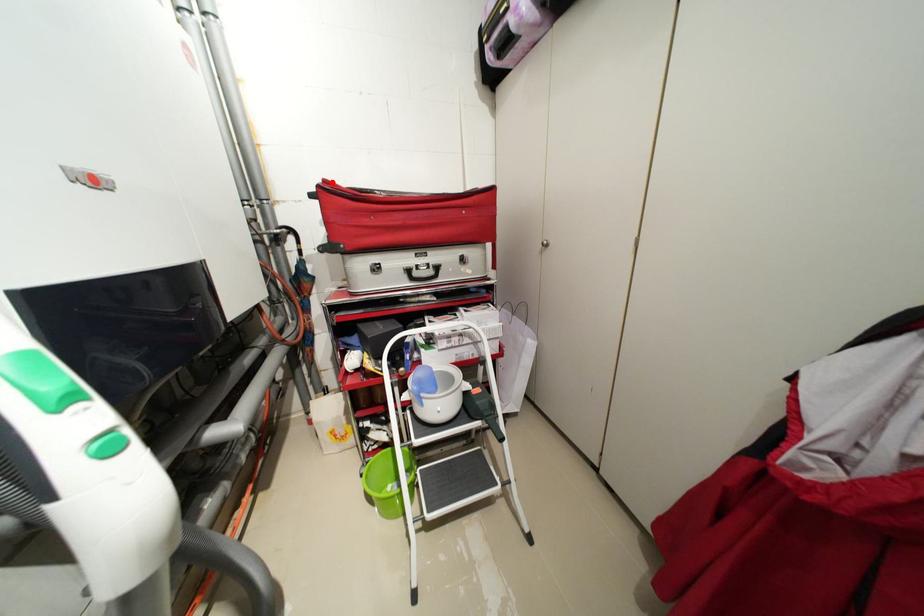
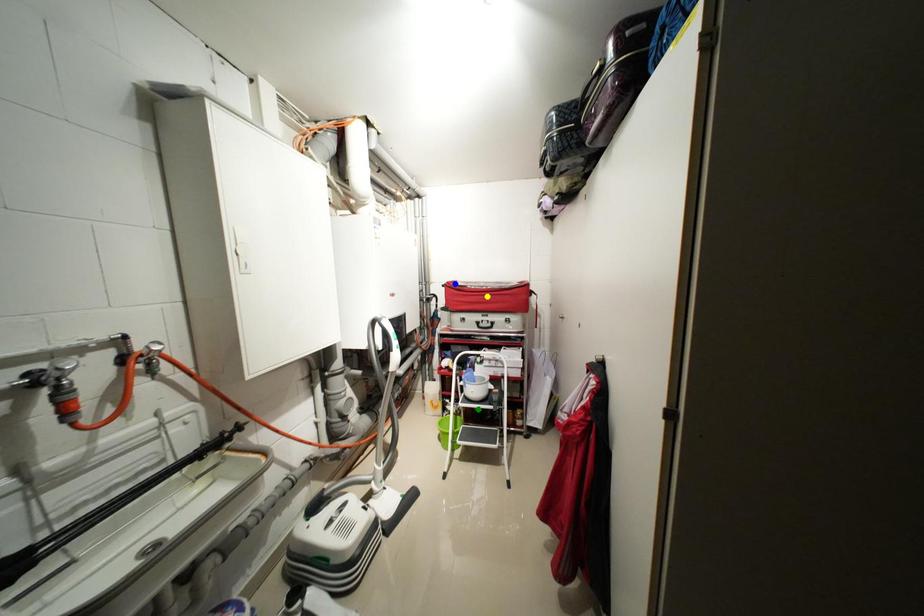
Question: I am providing you with two images of the same scene from different viewpoints. A red point is marked on the first image. You are given multiple points on the second image. Which mark in image 2 goes with the point in image 1?

Choices:
 (A) green point
 (B) blue point
 (C) yellow point

Answer: (B)